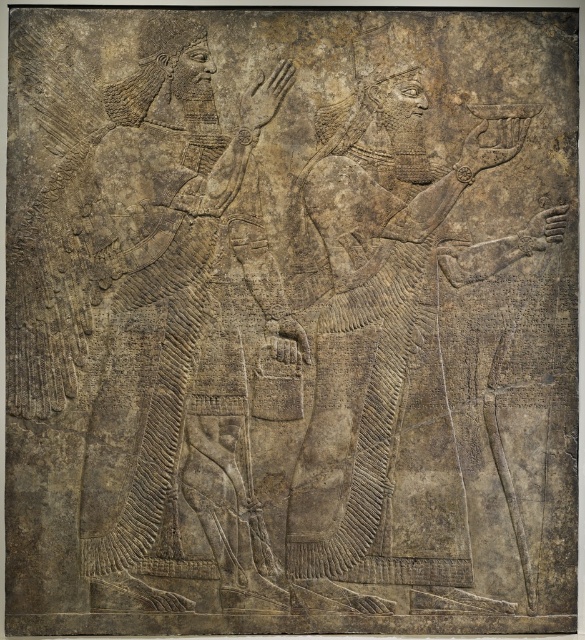
You are an archaeologist examining the ancient bas relief sculpture. You notice a specific point marked at coordinates (390, 342). Based on the scene, where exactly on the sculpture is this point located?

The point at (390, 342) is located on the carved stone figure at center.